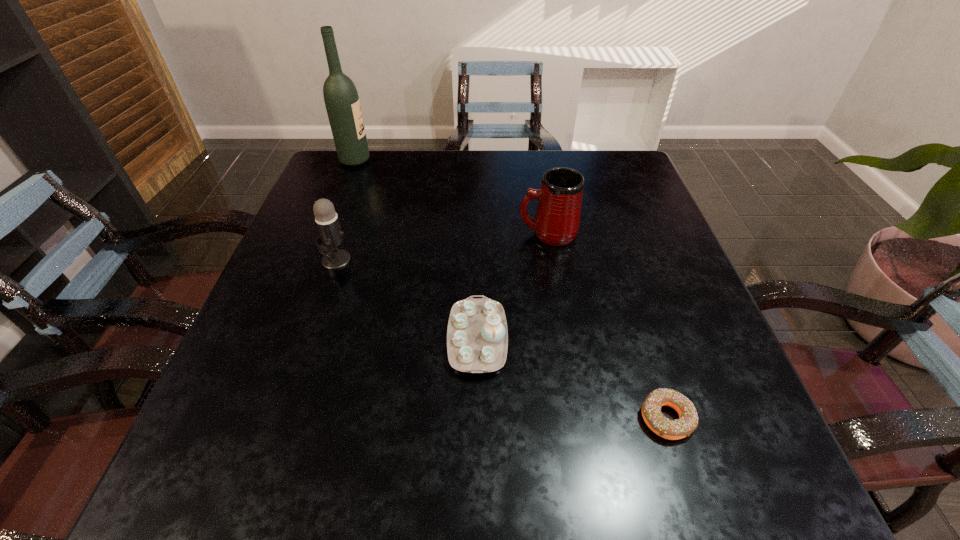
The width and height of the screenshot is (960, 540). I want to click on free space between the shortest object and the second object from right to left, so click(607, 325).

Image resolution: width=960 pixels, height=540 pixels. I want to click on free spot between the mug and the second nearest object, so click(513, 286).

At what (x,y) coordinates should I click in order to perform the action: click on free area in between the doughnut and the second shortest object. Please return your answer as a coordinate pair (x, y). The image size is (960, 540). Looking at the image, I should click on (571, 378).

Locate an element on the screen. The image size is (960, 540). free space between the third object from right to left and the second farthest object is located at coordinates (513, 286).

Identify the location of vacant point located between the third farthest object and the chinaware. (407, 299).

The image size is (960, 540). What are the coordinates of `vacant space that is in between the fourth tallest object and the fourth object from left to right` in the screenshot? It's located at (513, 286).

Find the location of a particular element. empty space that is in between the third nearest object and the second object from right to left is located at coordinates (442, 246).

Identify the location of object that ranks as the third closest to the second nearest object. The width and height of the screenshot is (960, 540). (331, 236).

You are a GUI agent. You are given a task and a screenshot of the screen. Output one action in this format:
    pyautogui.click(x=<x>, y=<y>)
    Task: Click on the object that can be found as the fourth closest to the doughnut
    This screenshot has height=540, width=960.
    Given the screenshot: What is the action you would take?
    pyautogui.click(x=341, y=98)

Find the location of `vacant space that satisfies the following two spatial constraints: 1. on the labeled side of the wine bottle; 2. on the left side of the nearest object`. vacant space that satisfies the following two spatial constraints: 1. on the labeled side of the wine bottle; 2. on the left side of the nearest object is located at coordinates (256, 417).